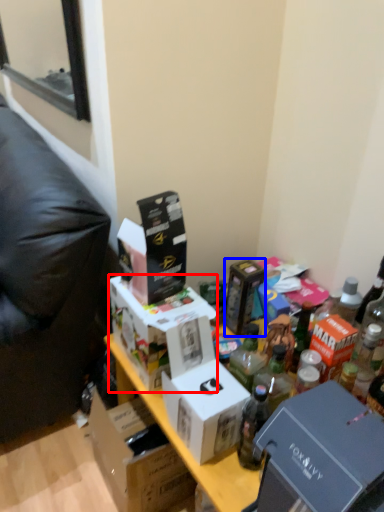
Question: Which of the following is the closest to the observer, box (highlighted by a red box) or box (highlighted by a blue box)?

Choices:
 (A) box
 (B) box

Answer: (A)